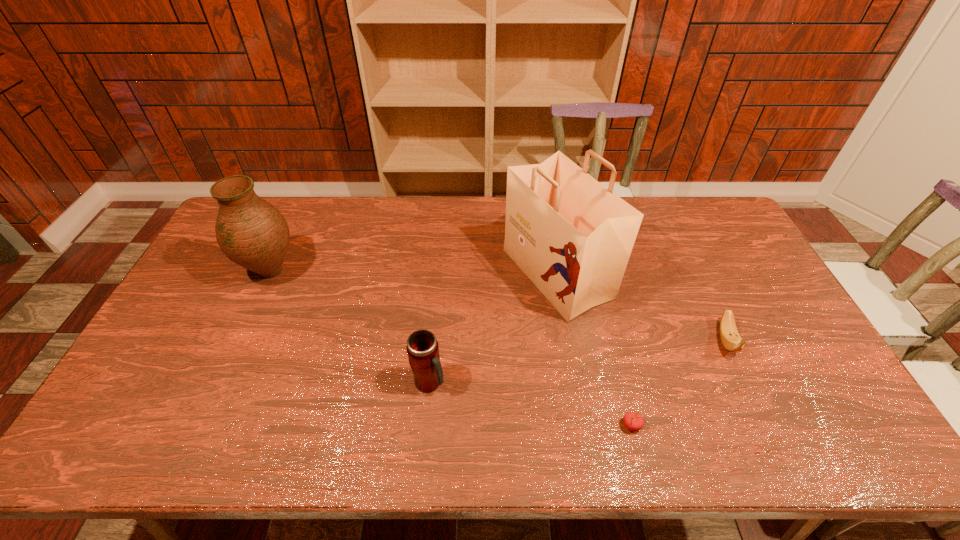
The image size is (960, 540). I want to click on grocery bag, so click(572, 237).

Identify the location of vase. This screenshot has height=540, width=960. (251, 232).

Image resolution: width=960 pixels, height=540 pixels. Find the location of `the fourth shortest object`. the fourth shortest object is located at coordinates (251, 232).

The image size is (960, 540). What are the coordinates of `thermos bottle` in the screenshot? It's located at (422, 347).

Locate an element on the screen. the fourth farthest object is located at coordinates (422, 347).

I want to click on banana, so click(x=730, y=338).

Identify the location of cherry. The width and height of the screenshot is (960, 540). (633, 421).

In order to click on free spot located on the side of the grocery bag with the superhero design in this screenshot , I will do `click(462, 274)`.

Where is `free space located on the side of the grocery bag with the superhero design`? This screenshot has height=540, width=960. free space located on the side of the grocery bag with the superhero design is located at coordinates (477, 274).

This screenshot has height=540, width=960. In order to click on vacant point located on the side of the grocery bag with the superhero design in this screenshot , I will do `click(470, 274)`.